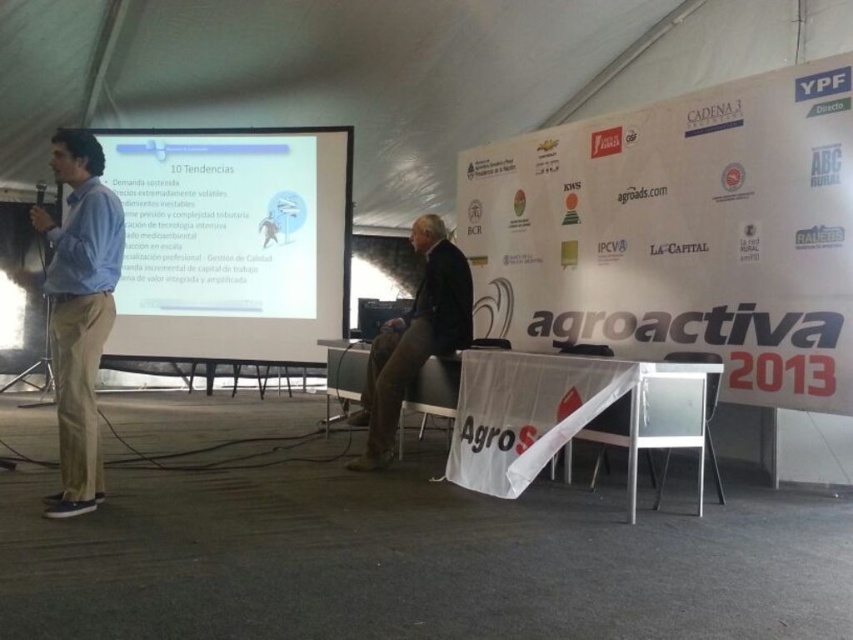
Question: Based on their relative distances, which object is farther from the light blue shirt at left?

Choices:
 (A) white matte projection screen at center
 (B) white paper banner at upper center
 (C) dark brown leather jacket at center

Answer: (B)

Question: Can you confirm if light blue shirt at left is wider than dark brown leather jacket at center?

Choices:
 (A) no
 (B) yes

Answer: (A)

Question: Which point is closer to the camera?

Choices:
 (A) (183, 211)
 (B) (758, 100)
 (C) (107, 232)

Answer: (C)

Question: Is white matte projection screen at center positioned at the back of light blue shirt at left?

Choices:
 (A) yes
 (B) no

Answer: (A)

Question: Is the position of white paper banner at upper center more distant than that of white matte projection screen at center?

Choices:
 (A) yes
 (B) no

Answer: (B)

Question: Which of the following is the closest to the observer?

Choices:
 (A) white paper banner at upper center
 (B) white matte projection screen at center
 (C) light blue shirt at left
 (D) dark brown leather jacket at center

Answer: (C)